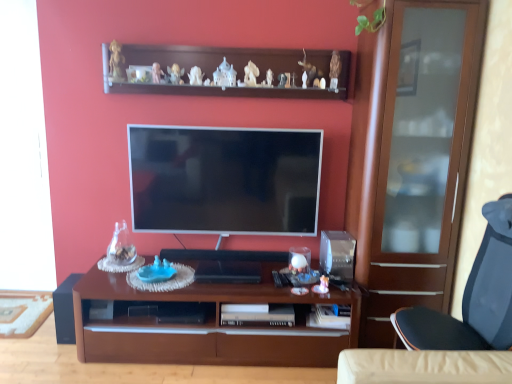
Question: Considering their positions, is black matte speaker at lower left located in front of or behind blue plastic toy at center?

Choices:
 (A) behind
 (B) front

Answer: (A)

Question: Does point (56, 337) appear closer or farther from the camera than point (152, 278)?

Choices:
 (A) farther
 (B) closer

Answer: (A)

Question: Which object is positioned farthest from the blue plastic toy at center?

Choices:
 (A) wooden desk at center
 (B) matte brown cabinet at right
 (C) black mesh chair at right
 (D) wooden shelf at upper center
 (E) black matte speaker at lower left

Answer: (C)

Question: Based on their relative distances, which object is nearer to the black mesh chair at right?

Choices:
 (A) wooden desk at center
 (B) wooden shelf at upper center
 (C) blue plastic toy at center
 (D) black matte speaker at lower left
 (E) matte brown cabinet at right

Answer: (E)